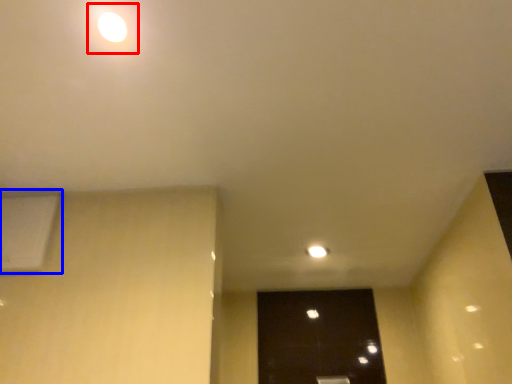
Question: Which object is closer to the camera taking this photo, light (highlighted by a red box) or air conditioning (highlighted by a blue box)?

Choices:
 (A) light
 (B) air conditioning

Answer: (A)